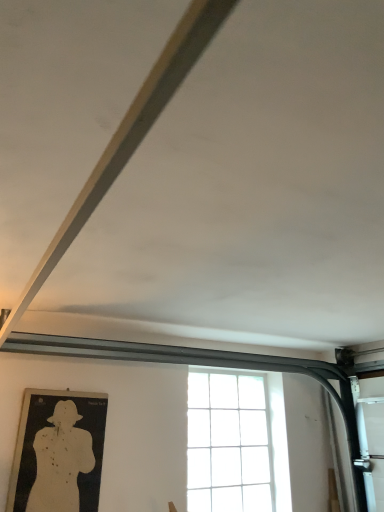
Question: Should I look upward or downward to see clear glass window at center?

Choices:
 (A) down
 (B) up

Answer: (A)

Question: Is white paper target at lower left positioned beyond the bounds of clear glass window at center?

Choices:
 (A) yes
 (B) no

Answer: (A)

Question: Can you confirm if white paper target at lower left is taller than clear glass window at center?

Choices:
 (A) no
 (B) yes

Answer: (A)

Question: Is there a large distance between white paper target at lower left and clear glass window at center?

Choices:
 (A) yes
 (B) no

Answer: (A)

Question: Does white paper target at lower left have a lesser width compared to clear glass window at center?

Choices:
 (A) no
 (B) yes

Answer: (B)

Question: From a real-world perspective, is white paper target at lower left on top of clear glass window at center?

Choices:
 (A) yes
 (B) no

Answer: (B)

Question: From the image's perspective, is white paper target at lower left below clear glass window at center?

Choices:
 (A) no
 (B) yes

Answer: (A)

Question: Can you confirm if clear glass window at center is smaller than white paper target at lower left?

Choices:
 (A) yes
 (B) no

Answer: (B)

Question: From the image's perspective, is clear glass window at center located beneath white paper target at lower left?

Choices:
 (A) yes
 (B) no

Answer: (A)

Question: Is clear glass window at center surrounding white paper target at lower left?

Choices:
 (A) no
 (B) yes

Answer: (A)

Question: From a real-world perspective, is clear glass window at center on top of white paper target at lower left?

Choices:
 (A) no
 (B) yes

Answer: (B)

Question: Is clear glass window at center thinner than white paper target at lower left?

Choices:
 (A) no
 (B) yes

Answer: (A)

Question: Considering the relative positions of clear glass window at center and white paper target at lower left in the image provided, is clear glass window at center to the right of white paper target at lower left from the viewer's perspective?

Choices:
 (A) yes
 (B) no

Answer: (A)

Question: From their relative heights in the image, would you say white paper target at lower left is taller or shorter than clear glass window at center?

Choices:
 (A) tall
 (B) short

Answer: (B)